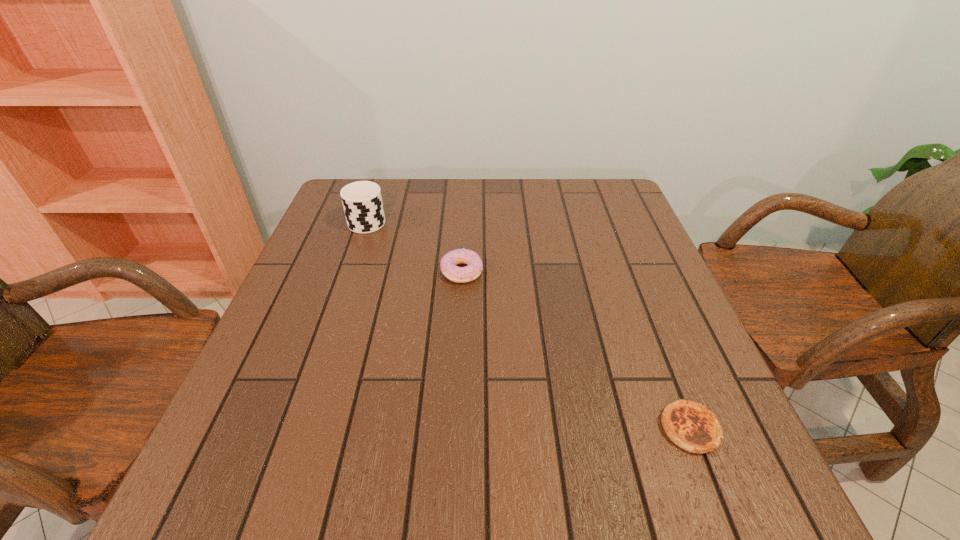
Where is `the tallest object`? the tallest object is located at coordinates (362, 201).

I want to click on the leftmost object, so click(362, 201).

This screenshot has height=540, width=960. Identify the location of the second farthest object. (448, 263).

I want to click on doughnut, so click(x=448, y=263).

At what (x,y) coordinates should I click in order to perform the action: click on the shortest object. Please return your answer as a coordinate pair (x, y). Looking at the image, I should click on (690, 425).

This screenshot has width=960, height=540. Find the location of `quiche`. quiche is located at coordinates (690, 425).

I want to click on vacant space positioned on the side of the cup with the handle, so click(376, 194).

This screenshot has width=960, height=540. I want to click on vacant space located 0.120m on the side of the cup with the handle, so click(379, 186).

You are a GUI agent. You are given a task and a screenshot of the screen. Output one action in this format:
    pyautogui.click(x=<x>, y=<y>)
    Task: Click on the free region located 0.090m on the side of the cup with the handle
    
    Given the screenshot: What is the action you would take?
    pyautogui.click(x=378, y=191)

The width and height of the screenshot is (960, 540). Find the location of `vacant space located 0.130m on the front of the second tallest object`. vacant space located 0.130m on the front of the second tallest object is located at coordinates (459, 328).